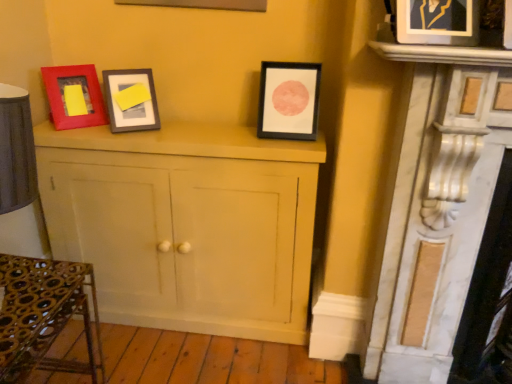
Where is `vacant position to the left of black matte picture frame at center, marked as the 2th picture frame in a front-to-back arrangement`? vacant position to the left of black matte picture frame at center, marked as the 2th picture frame in a front-to-back arrangement is located at coordinates (239, 134).